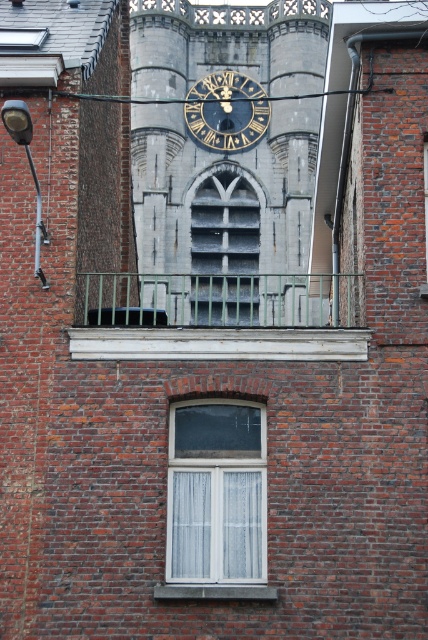
Question: Which object is positioned closest to the metallic wire at upper center?

Choices:
 (A) white plastic window at center
 (B) gray stone clock tower at center

Answer: (B)

Question: Considering the real-world distances, which object is closest to the white plastic window at center?

Choices:
 (A) blue metallic clock at center
 (B) metallic wire at upper center
 (C) gray stone clock tower at center

Answer: (B)

Question: Does gray stone clock tower at center have a greater width compared to blue metallic clock at center?

Choices:
 (A) no
 (B) yes

Answer: (B)

Question: Does gray stone clock tower at center lie in front of white plastic window at center?

Choices:
 (A) yes
 (B) no

Answer: (B)

Question: Which point is farther to the camera?

Choices:
 (A) (136, 200)
 (B) (258, 113)

Answer: (B)

Question: Where is gray stone clock tower at center located in relation to metallic wire at upper center in the image?

Choices:
 (A) right
 (B) left

Answer: (B)